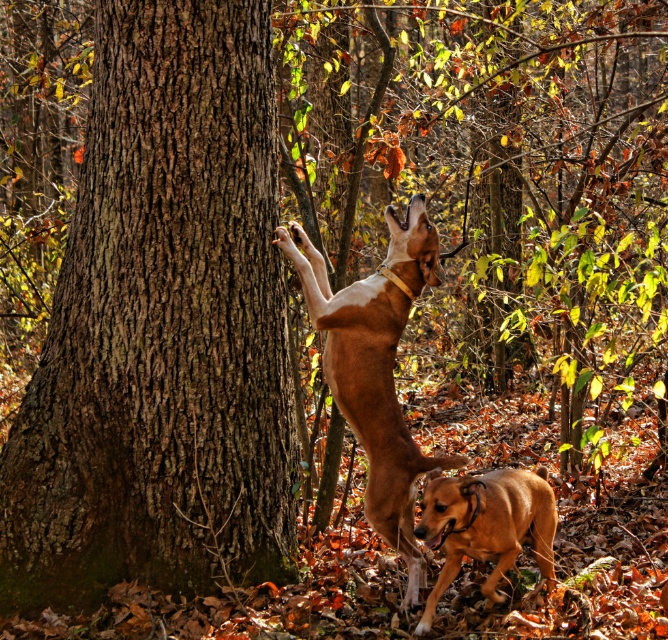
Can you confirm if brown rough bark at center is positioned below brown leather dog at lower right?

No, brown rough bark at center is not below brown leather dog at lower right.

Does brown rough bark at center have a smaller size compared to brown leather dog at lower right?

Incorrect, brown rough bark at center is not smaller in size than brown leather dog at lower right.

Is point (98, 106) in front of point (456, 538)?

That is False.

The width and height of the screenshot is (668, 640). Find the location of `brown rough bark at center`. brown rough bark at center is located at coordinates (162, 328).

Does brown rough bark at center have a larger size compared to brown glossy dog at center?

Yes, brown rough bark at center is bigger than brown glossy dog at center.

Between brown rough bark at center and brown glossy dog at center, which one has more height?

Standing taller between the two is brown rough bark at center.

Is point (182, 124) positioned before point (355, 413)?

Yes, point (182, 124) is closer to viewer.

Identify the location of brown rough bark at center. tap(162, 328).

Can you confirm if brown glossy dog at center is shorter than brown leather dog at lower right?

No, brown glossy dog at center is not shorter than brown leather dog at lower right.

Who is higher up, brown glossy dog at center or brown leather dog at lower right?

Positioned higher is brown glossy dog at center.

What do you see at coordinates (375, 365) in the screenshot? I see `brown glossy dog at center` at bounding box center [375, 365].

Find the location of a particular element. This screenshot has width=668, height=640. brown glossy dog at center is located at coordinates (375, 365).